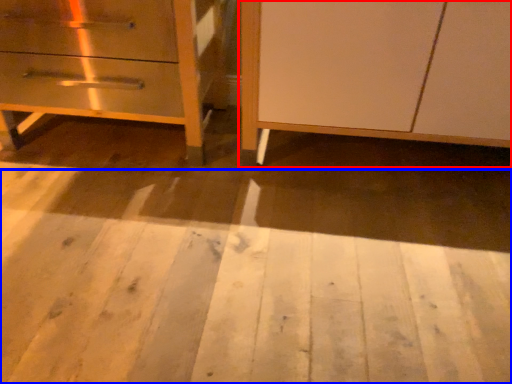
Question: Among these objects, which one is farthest to the camera, furniture (highlighted by a red box) or plywood (highlighted by a blue box)?

Choices:
 (A) furniture
 (B) plywood

Answer: (A)